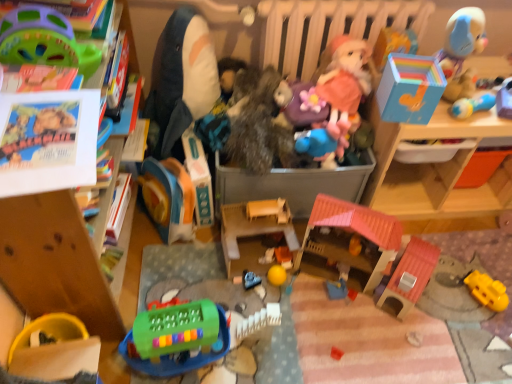
In order to click on vacant area in front of wooden toy storage at upper right in this screenshot , I will do `click(442, 294)`.